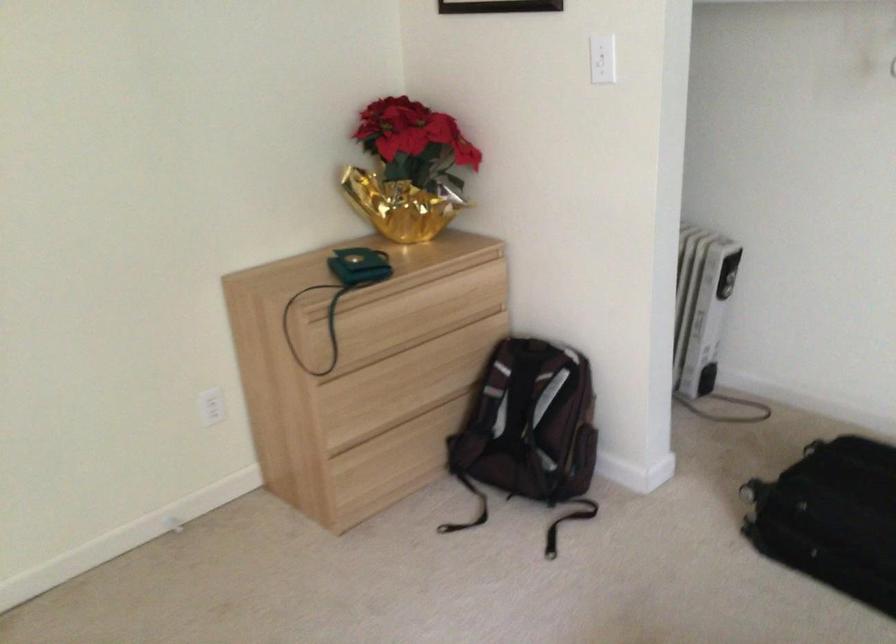
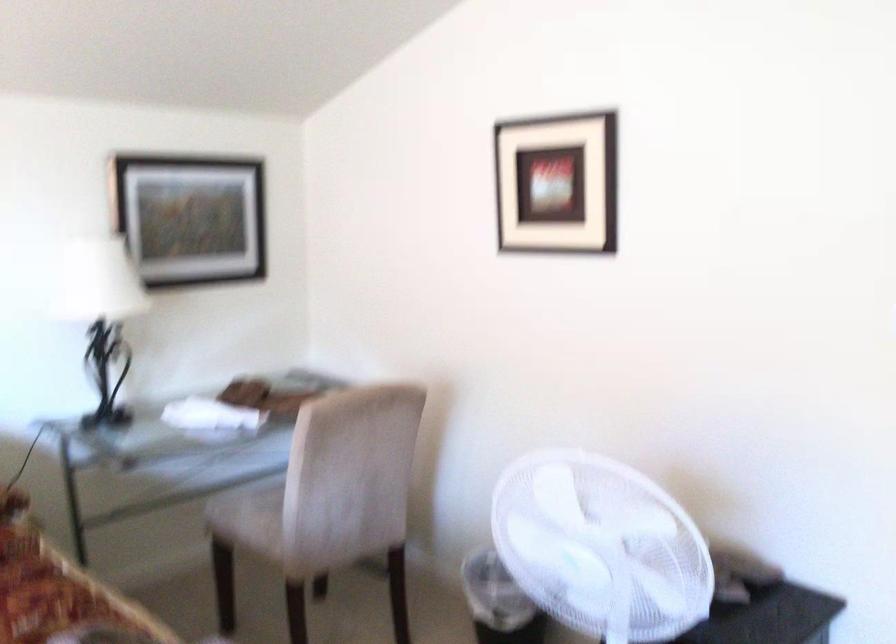
Question: How did the camera likely rotate?

Choices:
 (A) Left
 (B) Right
 (C) Up
 (D) Down

Answer: (A)